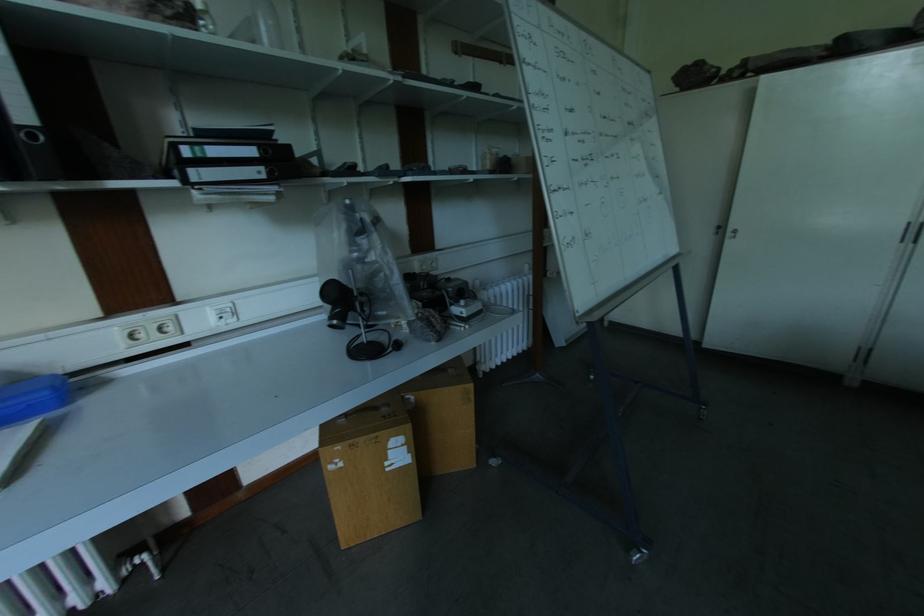
The image size is (924, 616). What are the coordinates of `blue plastic box` in the screenshot? It's located at (32, 398).